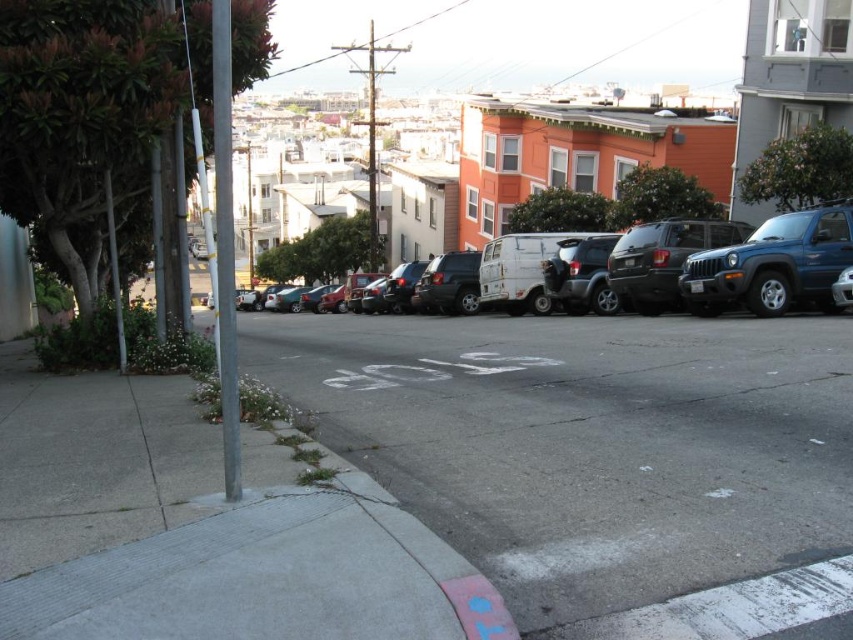
You are a delivery driver trying to navigate through the residential street. You see a matte white van at center and a blue metallic suv at right. Which vehicle is positioned higher up the street?

The matte white van at center is above the blue metallic suv at right, meaning it is higher up the street.

You are standing at point A located at coordinates point A at [824,285]. You want to walk to point B, which is 44.00 feet away. Given the street layout described, is there a clear path between these two points without crossing any parked cars or obstacles?

The points are 44.00 feet apart, but the street has parked cars along the right side. Without knowing the exact location of point B relative to the parked cars, it is impossible to determine if the path is clear. Check the positions of the parked vehicles before proceeding.